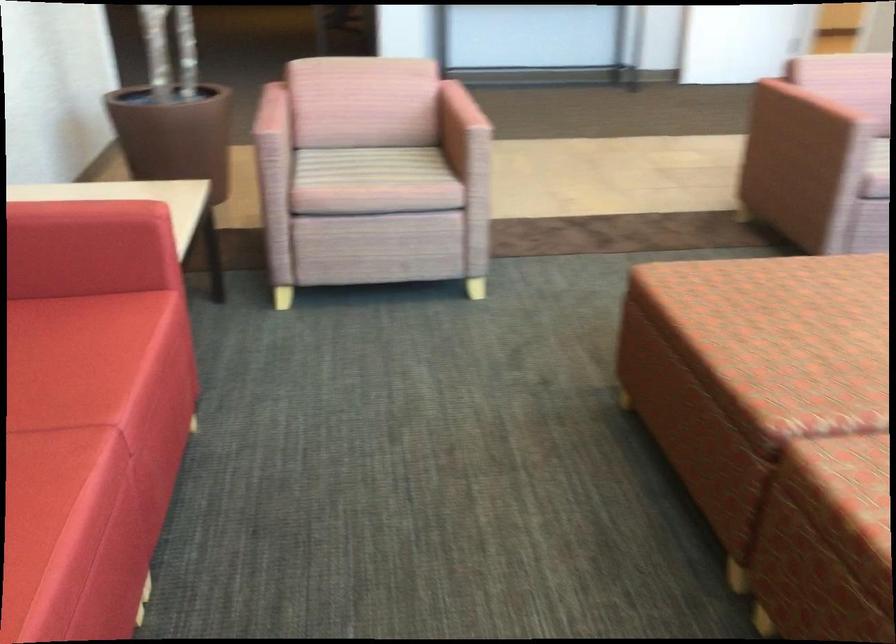
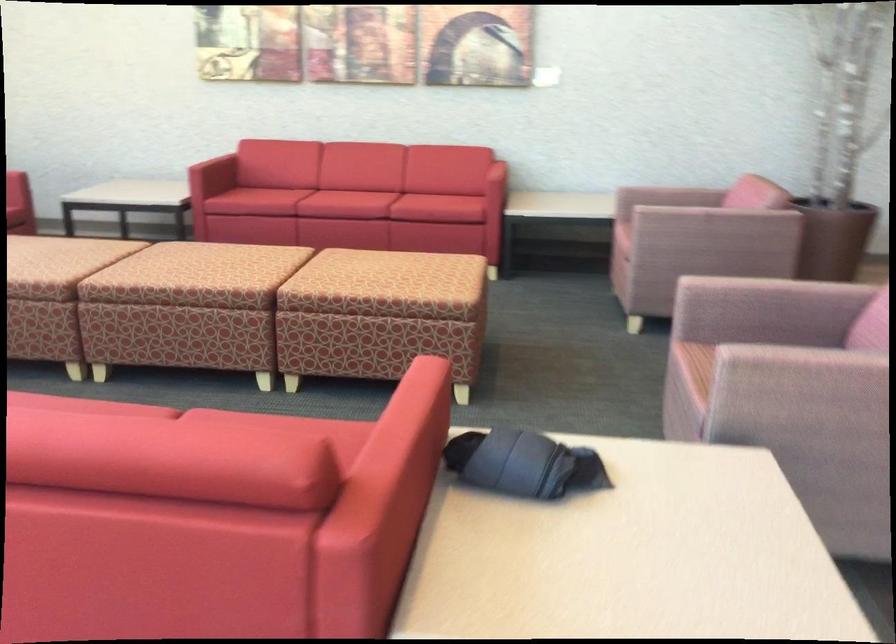
Find the pixel in the second image that matches (363,185) in the first image.

(624, 218)